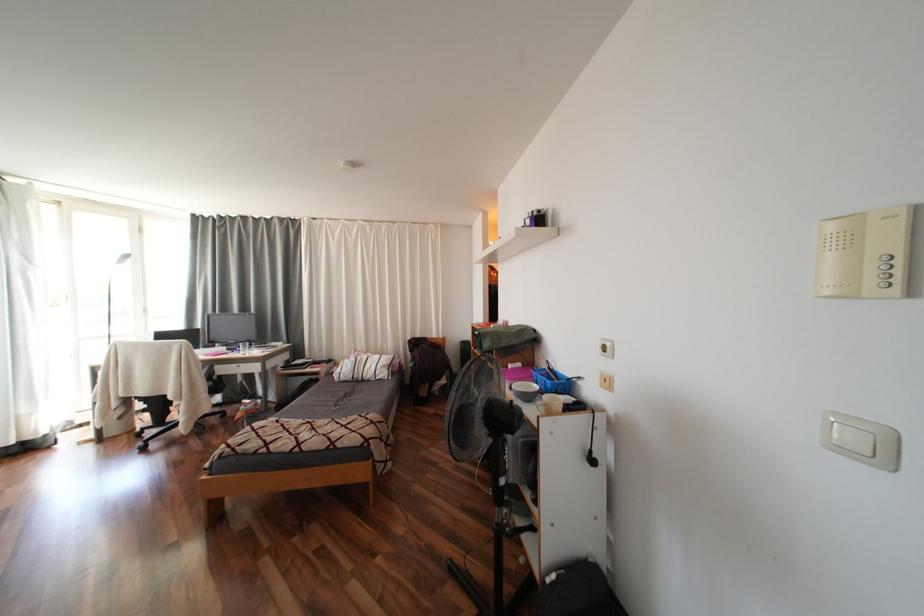
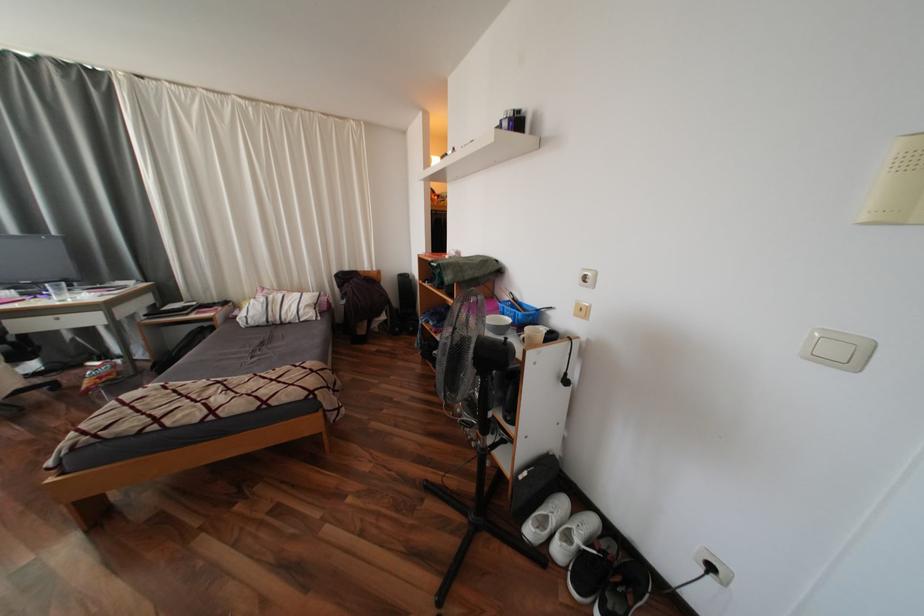
From the picture: First-person continuous shooting, in which direction is the camera rotating?

The camera rotated toward right-down.